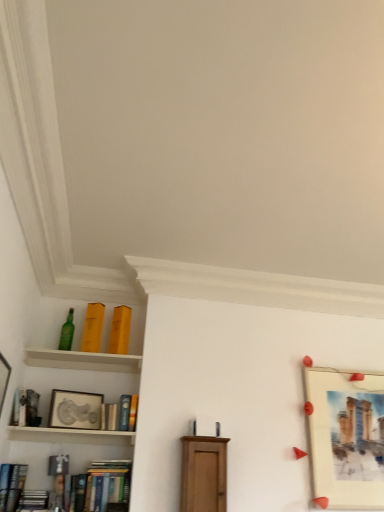
Question: From the image's perspective, is matte yellow book at upper left, marked as the eighth book in a bottom-to-top arrangement, under hardcover book at lower left, the first book when ordered from bottom to top?

Choices:
 (A) no
 (B) yes

Answer: (A)

Question: Is matte yellow book at upper left, which is the first book from top to bottom, next to hardcover book at lower left, the first book when ordered from bottom to top?

Choices:
 (A) yes
 (B) no

Answer: (B)

Question: Is the position of matte yellow book at upper left, marked as the eighth book in a bottom-to-top arrangement, more distant than that of hardcover book at lower left, the first book when ordered from bottom to top?

Choices:
 (A) no
 (B) yes

Answer: (B)

Question: From a real-world perspective, does matte yellow book at upper left, marked as the eighth book in a bottom-to-top arrangement, sit lower than hardcover book at lower left, the first book when ordered from bottom to top?

Choices:
 (A) yes
 (B) no

Answer: (B)

Question: Is matte yellow book at upper left, which is the first book from top to bottom, wider than hardcover book at lower left, arranged as the eighth book when viewed from the top?

Choices:
 (A) yes
 (B) no

Answer: (A)

Question: From the image's perspective, is green glass bottle at upper left located above or below hardcover book at lower left, the 5th book when ordered from top to bottom?

Choices:
 (A) above
 (B) below

Answer: (A)

Question: From a real-world perspective, is green glass bottle at upper left physically located above or below hardcover book at lower left, the 5th book when ordered from top to bottom?

Choices:
 (A) below
 (B) above

Answer: (B)

Question: Considering the relative positions of green glass bottle at upper left and hardcover book at lower left, arranged as the 4th book when ordered from the bottom, in the image provided, is green glass bottle at upper left to the left or to the right of hardcover book at lower left, arranged as the 4th book when ordered from the bottom,?

Choices:
 (A) right
 (B) left

Answer: (A)

Question: Looking at their shapes, would you say green glass bottle at upper left is wider or thinner than hardcover book at lower left, arranged as the 4th book when ordered from the bottom?

Choices:
 (A) wide
 (B) thin

Answer: (A)

Question: In the image, is hardcover book at lower left, the 5th book when ordered from top to bottom, positioned in front of or behind matte yellow book at upper left, which is the first book from top to bottom?

Choices:
 (A) front
 (B) behind

Answer: (A)

Question: Considering the positions of point 3,493 and point 92,330, is point 3,493 closer or farther from the camera than point 92,330?

Choices:
 (A) farther
 (B) closer

Answer: (B)

Question: Would you say hardcover book at lower left, arranged as the 4th book when ordered from the bottom, is to the left or to the right of matte yellow book at upper left, marked as the eighth book in a bottom-to-top arrangement, in the picture?

Choices:
 (A) left
 (B) right

Answer: (A)

Question: From a real-world perspective, is hardcover book at lower left, the 5th book when ordered from top to bottom, physically located above or below matte yellow book at upper left, which is the first book from top to bottom?

Choices:
 (A) above
 (B) below

Answer: (B)

Question: In terms of width, does matte wood cabinet at center look wider or thinner when compared to matte yellow book at upper left, marked as the eighth book in a bottom-to-top arrangement?

Choices:
 (A) thin
 (B) wide

Answer: (A)

Question: From their relative heights in the image, would you say matte wood cabinet at center is taller or shorter than matte yellow book at upper left, which is the first book from top to bottom?

Choices:
 (A) tall
 (B) short

Answer: (A)